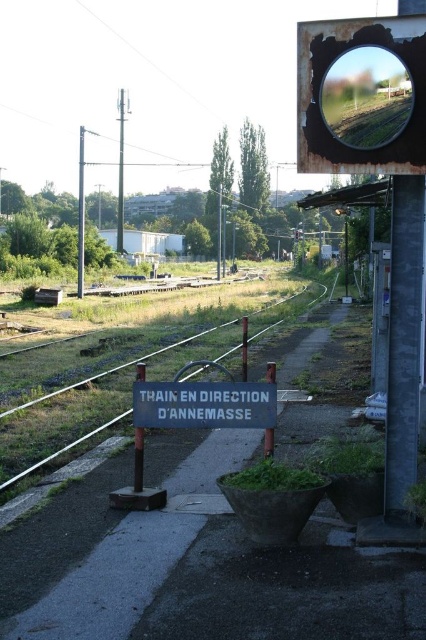
Which of these two, smooth gray pole at left or blue painted metal pole at center, stands taller?

Standing taller between the two is smooth gray pole at left.

In the scene shown: How far apart are smooth gray pole at left and blue painted metal pole at center?

They are 64.80 meters apart.

Between point (81, 221) and point (141, 432), which one is positioned in front?

Positioned in front is point (141, 432).

Where is `smooth gray pole at left`? This screenshot has height=640, width=426. smooth gray pole at left is located at coordinates (80, 214).

Does point (253, 385) come closer to viewer compared to point (143, 372)?

Yes, it is.

Does point (189, 410) come in front of point (138, 449)?

Yes, it is in front of point (138, 449).

Locate an element on the screen. This screenshot has width=426, height=640. blue painted wood sign at center is located at coordinates (204, 404).

Is metal train track at left shorter than blue painted metal pole at center?

Incorrect, metal train track at left's height does not fall short of blue painted metal pole at center's.

Can you confirm if metal train track at left is thinner than blue painted metal pole at center?

In fact, metal train track at left might be wider than blue painted metal pole at center.

Who is more distant from viewer, (336, 273) or (135, 426)?

Point (336, 273)

Where is `metal train track at left`? Image resolution: width=426 pixels, height=640 pixels. metal train track at left is located at coordinates (62, 451).